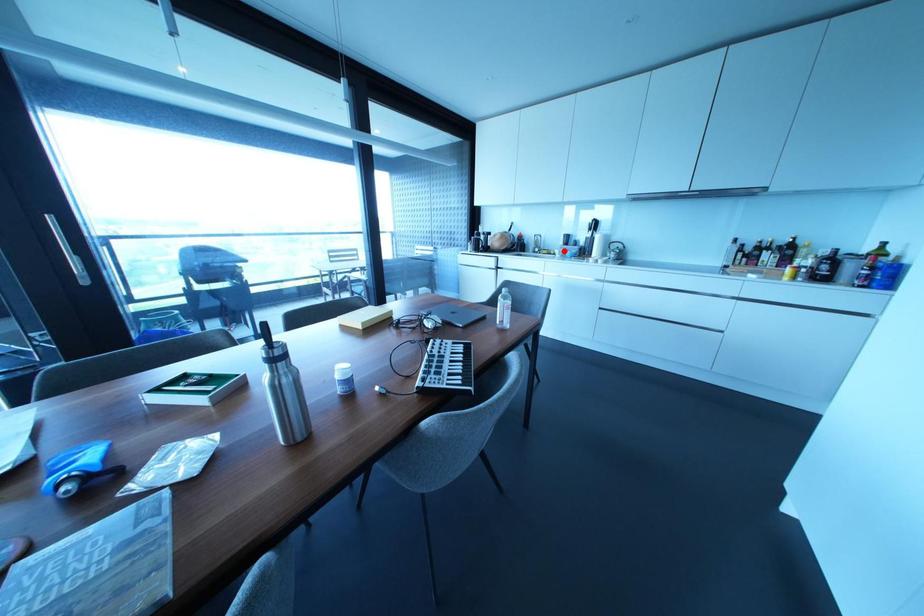
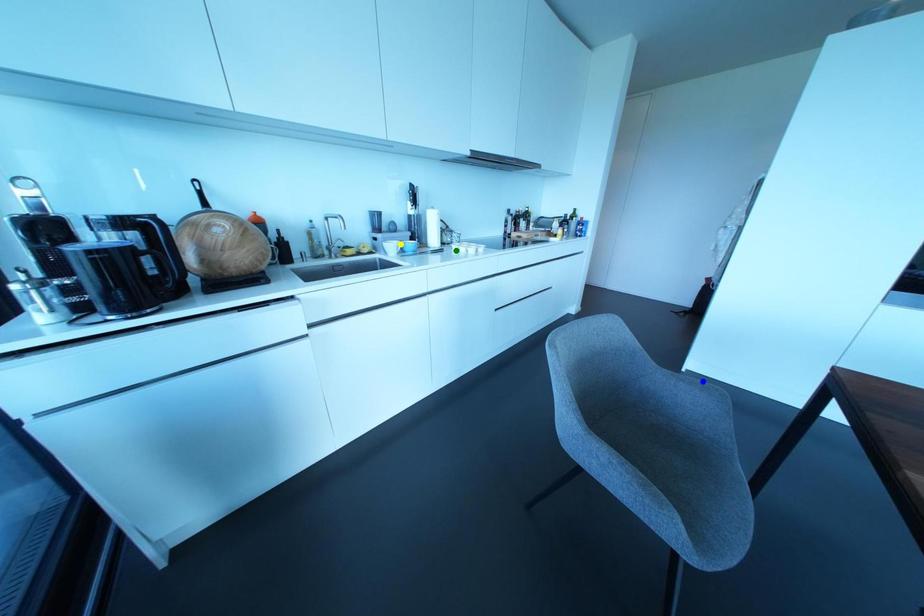
Question: I am providing you with two images of the same scene from different viewpoints. A red point is marked on the first image. You are given multiple points on the second image. Which spot in image 2 lines up with the point in image 1?

Choices:
 (A) blue point
 (B) green point
 (C) yellow point

Answer: (C)